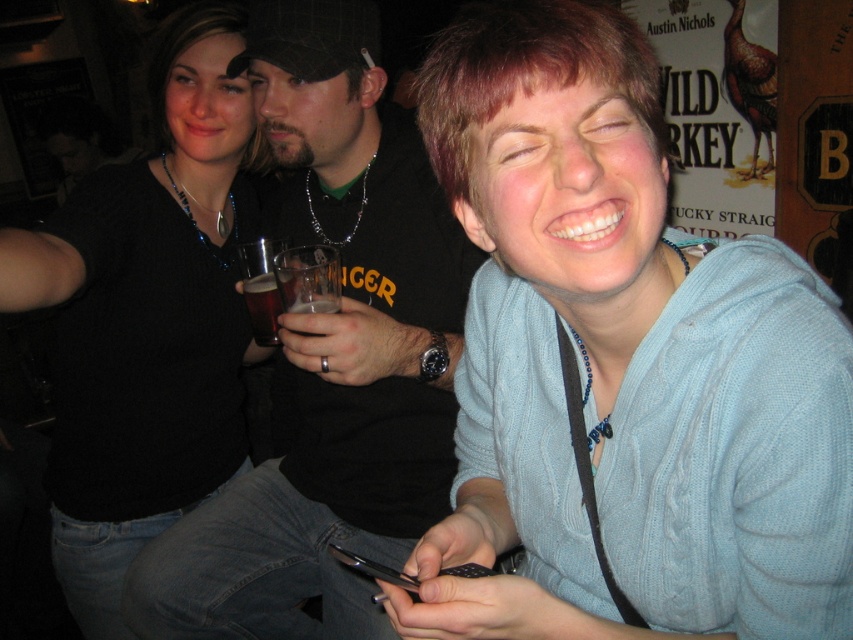
You are standing at the origin of a coordinate system in the image. There are two points marked in the scene. Which point is closer to you, point (x=202, y=285) or point (x=271, y=321)?

Point (x=271, y=321) is closer to you because the point (x=202, y=285) is behind it.